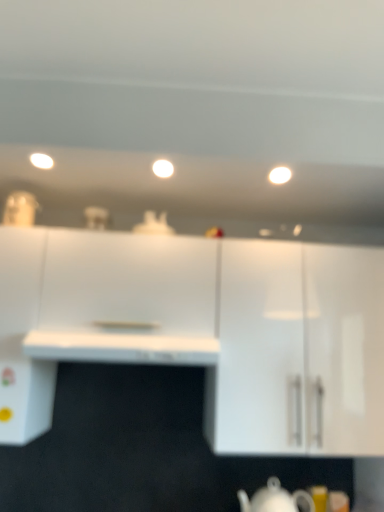
Image resolution: width=384 pixels, height=512 pixels. What are the coordinates of `vacant area situated to the left side of white glossy light fixture at center, the 2th lighting from the left` in the screenshot? It's located at (129, 162).